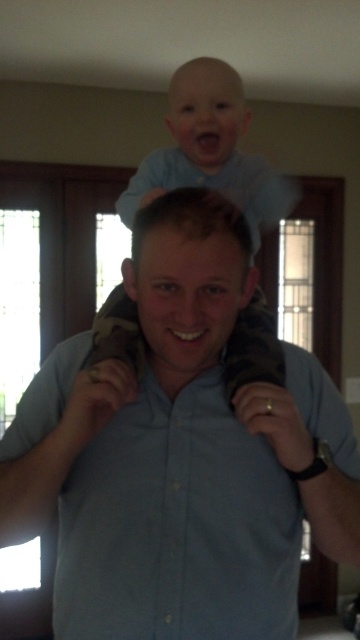
Which is more to the right, blue cotton shirt at center or light blue fabric at upper center?

Positioned to the right is light blue fabric at upper center.

Is blue cotton shirt at center above light blue fabric at upper center?

No.

Does point (27, 456) come behind point (227, 100)?

No, (27, 456) is closer to viewer.

Locate an element on the screen. This screenshot has width=360, height=640. blue cotton shirt at center is located at coordinates (180, 456).

Is point (226, 76) closer to viewer compared to point (216, 67)?

No, it is not.

Does light blue fabric at upper center appear on the left side of light blue shirt at upper center?

Correct, you'll find light blue fabric at upper center to the left of light blue shirt at upper center.

Locate an element on the screen. Image resolution: width=360 pixels, height=640 pixels. light blue fabric at upper center is located at coordinates (209, 150).

The image size is (360, 640). In order to click on light blue fabric at upper center in this screenshot , I will do `click(209, 150)`.

Can you confirm if blue cotton shirt at center is positioned below light blue shirt at upper center?

Correct, blue cotton shirt at center is located below light blue shirt at upper center.

Between blue cotton shirt at center and light blue shirt at upper center, which one has less height?

Standing shorter between the two is light blue shirt at upper center.

Which is in front, point (110, 417) or point (122, 209)?

Point (110, 417)

Where is `blue cotton shirt at center`? The width and height of the screenshot is (360, 640). blue cotton shirt at center is located at coordinates (180, 456).